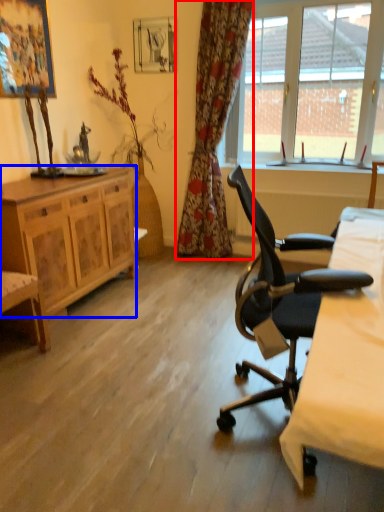
Question: Which object appears closest to the camera in this image, curtain (highlighted by a red box) or cabinetry (highlighted by a blue box)?

Choices:
 (A) curtain
 (B) cabinetry

Answer: (B)